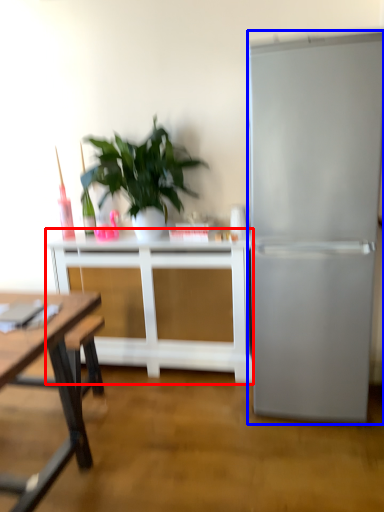
Question: Which of the following is the closest to the observer, table (highlighted by a red box) or refrigerator (highlighted by a blue box)?

Choices:
 (A) table
 (B) refrigerator

Answer: (B)